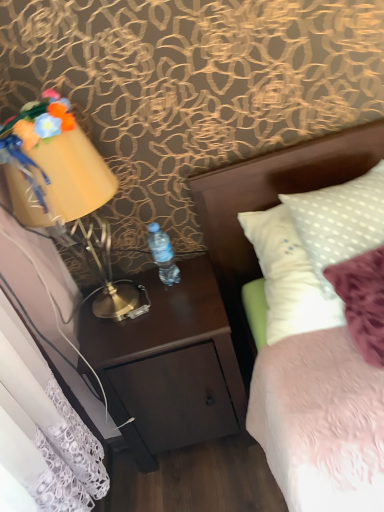
Image resolution: width=384 pixels, height=512 pixels. I want to click on vacant area on top of dark wood nightstand at center (from a real-world perspective), so click(151, 298).